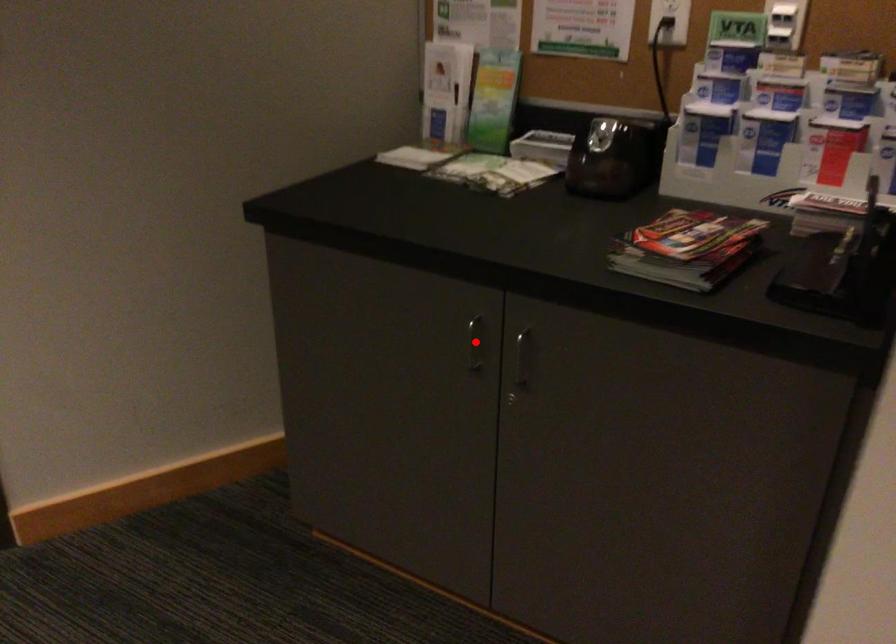
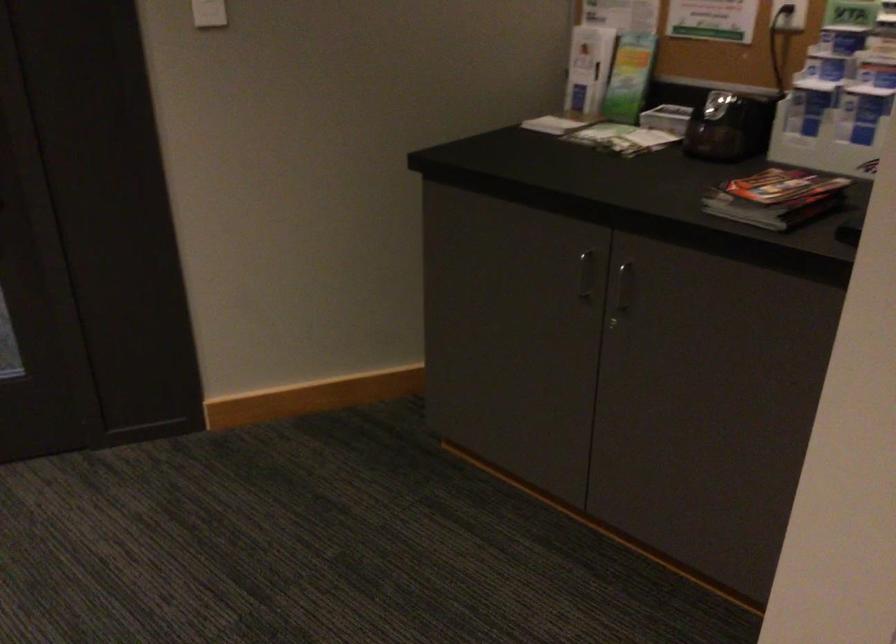
The point at the highlighted location is marked in the first image. Where is the corresponding point in the second image?

(584, 275)